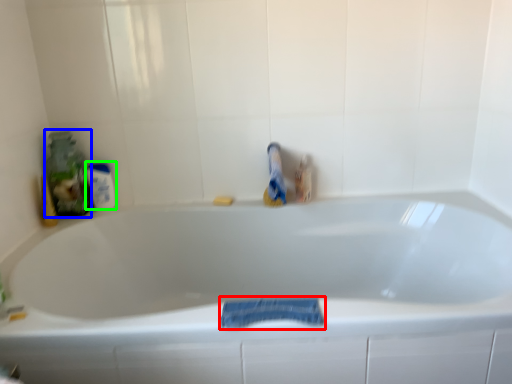
Question: Which is nearer to the bath towel (highlighted by a red box)? cleaning product (highlighted by a blue box) or mouthwash (highlighted by a green box).

Choices:
 (A) cleaning product
 (B) mouthwash

Answer: (B)